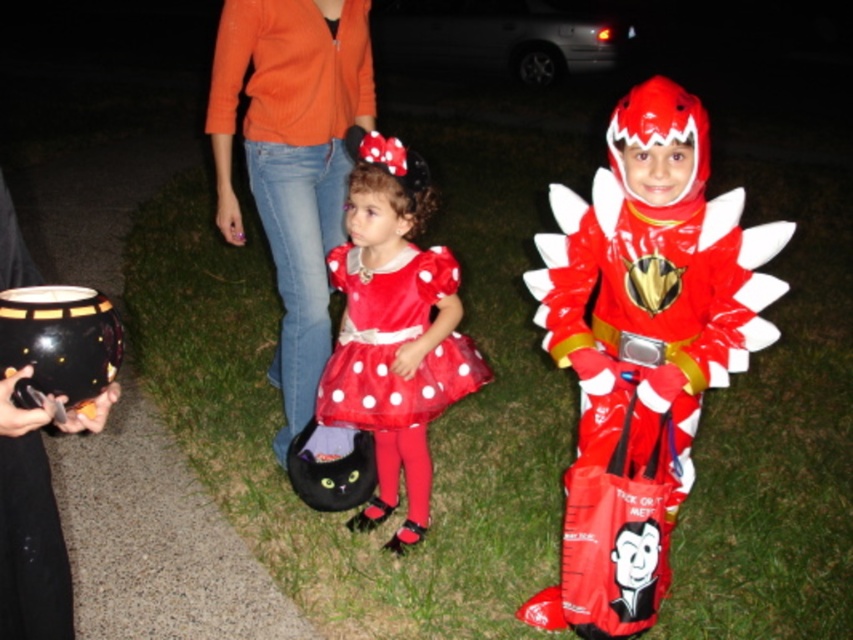
Question: Which point is closer to the camera taking this photo?

Choices:
 (A) (230, 220)
 (B) (657, 456)

Answer: (B)

Question: Which of these objects is positioned closest to the rubberized red dinosaur at right?

Choices:
 (A) red satin dress at center
 (B) orange cotton sweater at upper center

Answer: (A)

Question: Does shiny satin dress at center appear over red satin dress at center?

Choices:
 (A) no
 (B) yes

Answer: (B)

Question: Is shiny satin dress at center to the left of red satin dress at center from the viewer's perspective?

Choices:
 (A) yes
 (B) no

Answer: (B)

Question: Estimate the real-world distances between objects in this image. Which object is farther from the shiny satin dress at center?

Choices:
 (A) red satin dress at center
 (B) rubberized red dinosaur at right
 (C) orange cotton sweater at upper center

Answer: (B)

Question: Is shiny satin dress at center in front of red satin dress at center?

Choices:
 (A) yes
 (B) no

Answer: (A)